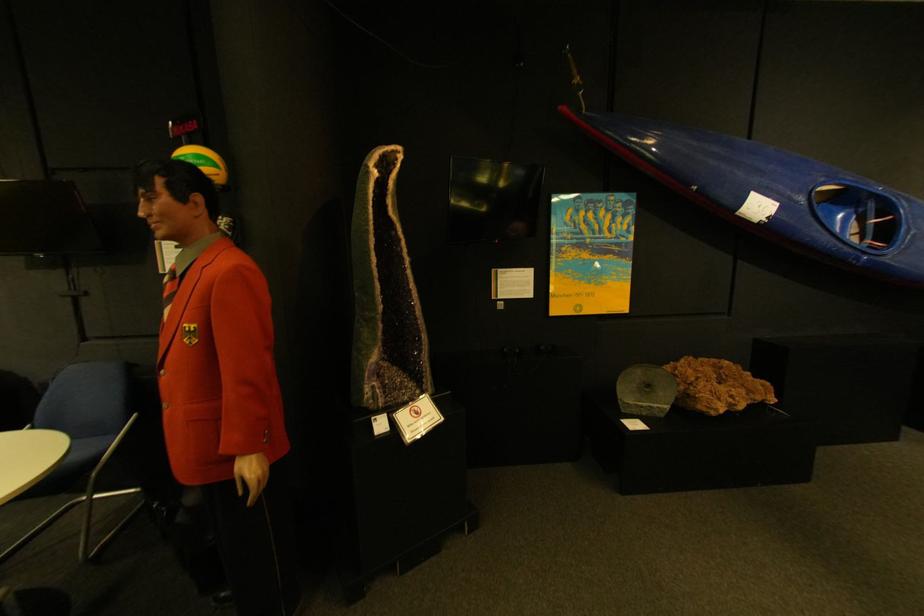
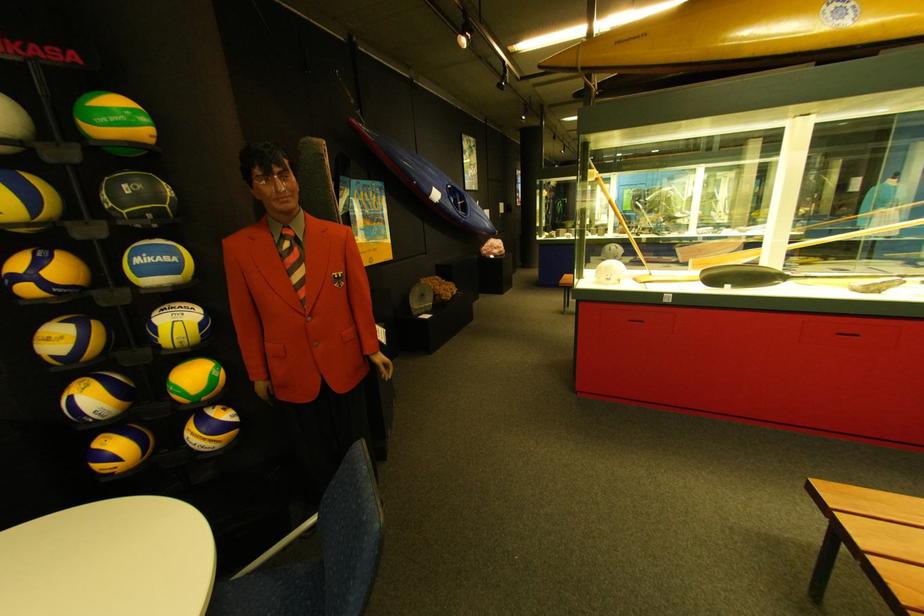
Where in the second image is the point corresponding to point (636, 397) from the first image?

(427, 307)